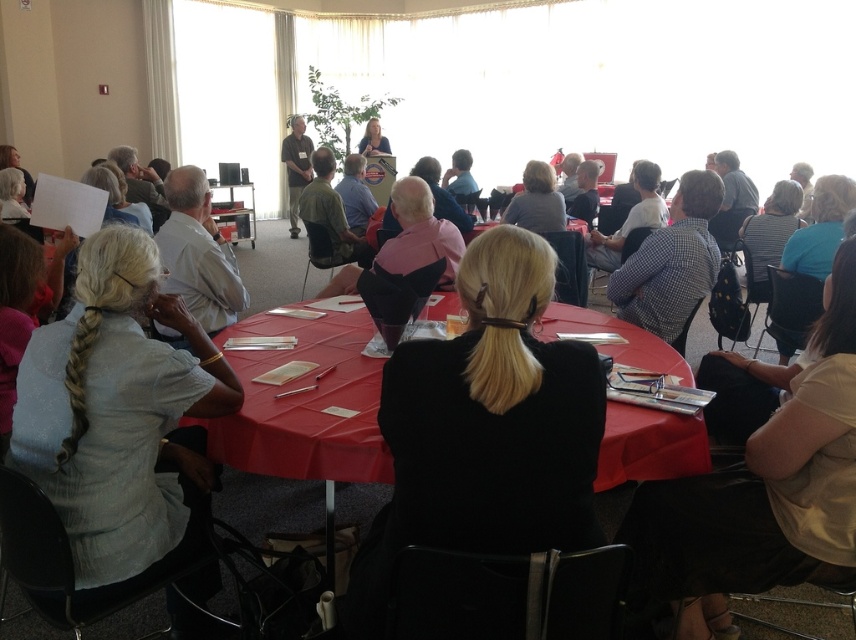
Who is higher up, matte brown shirt at center or matte black laptop at center?

matte black laptop at center is above.

Is matte brown shirt at center wider than matte black laptop at center?

Incorrect, matte brown shirt at center's width does not surpass matte black laptop at center's.

The width and height of the screenshot is (856, 640). What do you see at coordinates (296, 166) in the screenshot? I see `matte brown shirt at center` at bounding box center [296, 166].

Where is `matte brown shirt at center`? Image resolution: width=856 pixels, height=640 pixels. matte brown shirt at center is located at coordinates (296, 166).

Who is higher up, red cloth table at center or matte brown shirt at center?

matte brown shirt at center

Does red cloth table at center have a lesser width compared to matte brown shirt at center?

In fact, red cloth table at center might be wider than matte brown shirt at center.

Find the location of a particular element. red cloth table at center is located at coordinates (305, 404).

Is black fabric coat at center above red cloth table at center?

Actually, black fabric coat at center is below red cloth table at center.

Looking at this image, between black fabric coat at center and red cloth table at center, which one appears on the left side from the viewer's perspective?

From the viewer's perspective, red cloth table at center appears more on the left side.

Locate an element on the screen. Image resolution: width=856 pixels, height=640 pixels. black fabric coat at center is located at coordinates (485, 428).